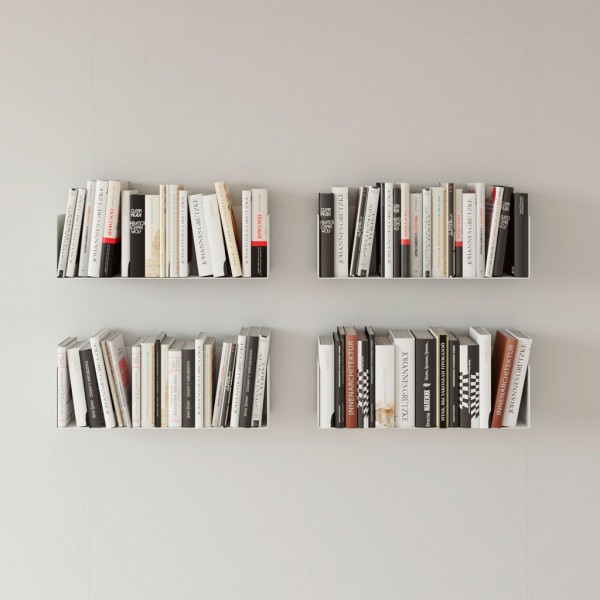
Where is `book shelves`? The image size is (600, 600). book shelves is located at coordinates tap(57, 216), tap(57, 390), tap(269, 392), tap(269, 261), tap(317, 247), tap(528, 248), tap(318, 400), tap(528, 407).